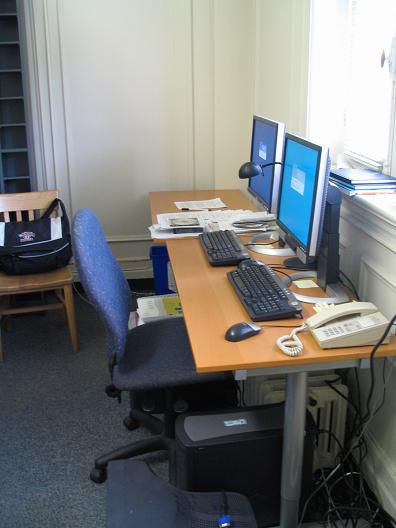
Find the location of a particular element. The width and height of the screenshot is (396, 528). monitor is located at coordinates (270, 166), (296, 204).